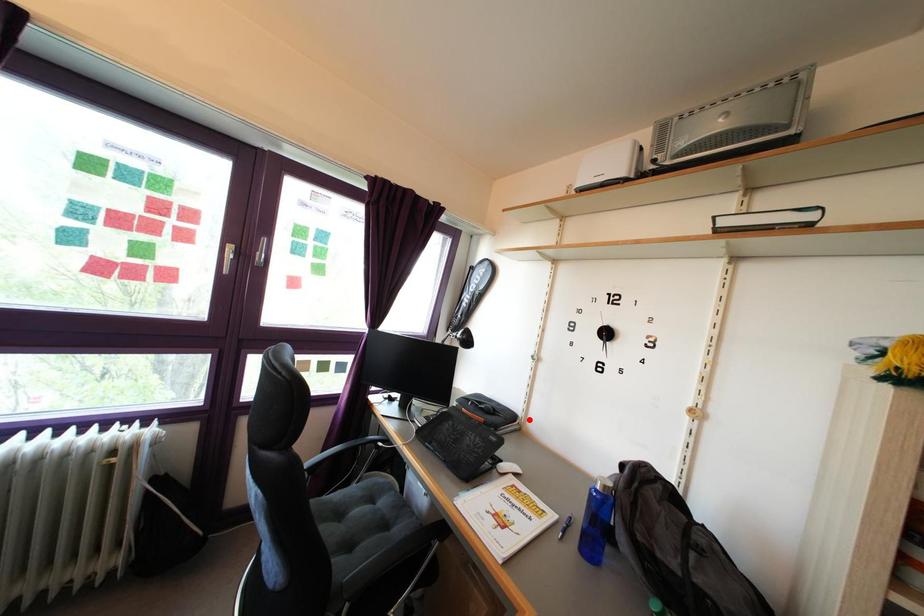
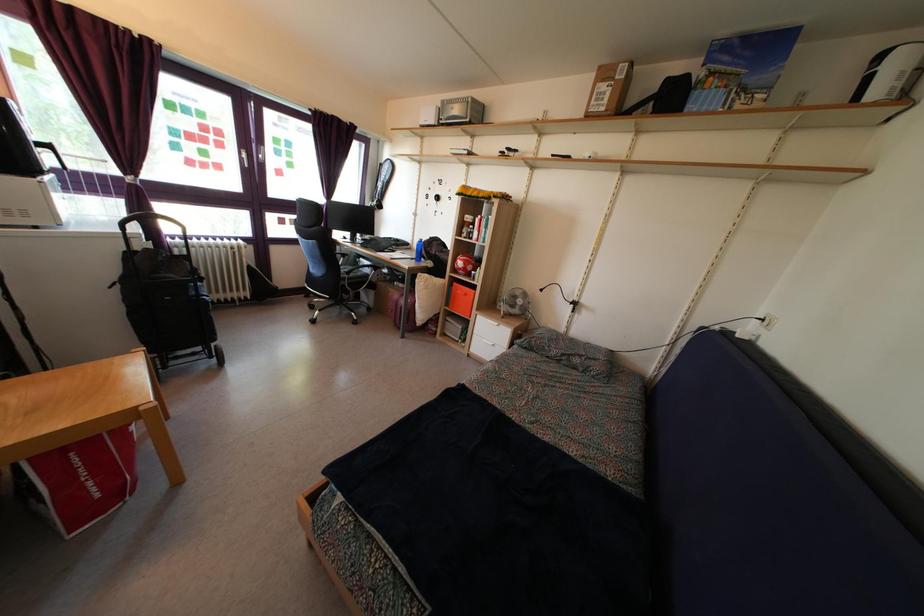
The point at the highlighted location is marked in the first image. Where is the corresponding point in the second image?

(416, 249)